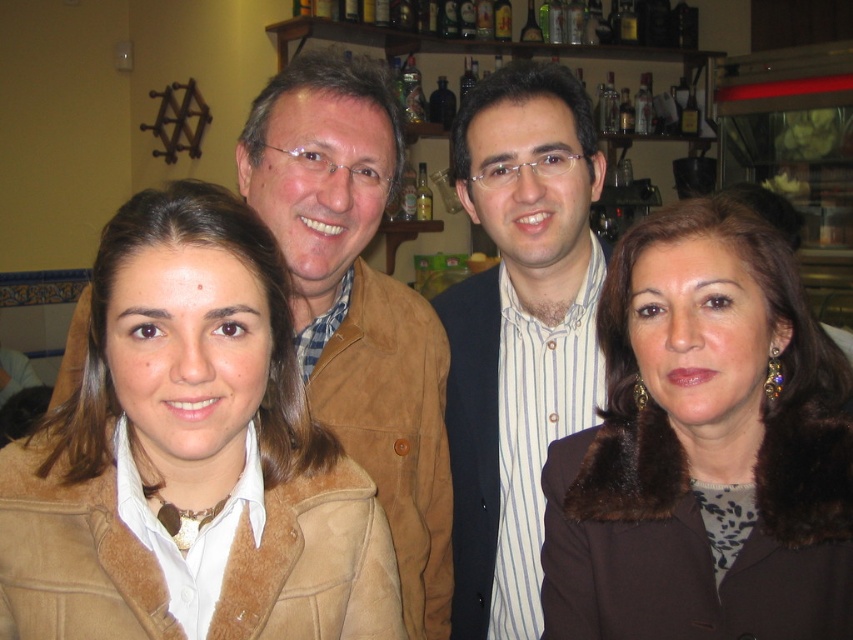
You are a photographer trying to capture a candid shot of the white striped shirt at center and the suede jacket at center. Which one is closer to the camera?

The white striped shirt at center is closer to the camera than the suede jacket at center.

You are a photographer setting up a group photo. You need to arrange the suede jacket at left and the white striped shirt at center so that both fit within a 1.2 meter wide frame. Given their sizes, which object requires more space horizontally?

The suede jacket at left requires more space horizontally because its width is larger than the white striped shirt at center.